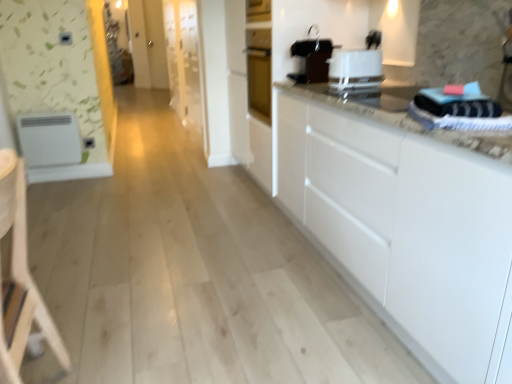
Question: Is light wood armchair at left surrounding white matte refrigerator at left, placed as the second appliance when sorted from right to left?

Choices:
 (A) yes
 (B) no

Answer: (B)

Question: Does light wood armchair at left have a greater height compared to white matte refrigerator at left, placed as the second appliance when sorted from right to left?

Choices:
 (A) yes
 (B) no

Answer: (A)

Question: From the image's perspective, is light wood armchair at left under white matte refrigerator at left, the 2th appliance when ordered from top to bottom?

Choices:
 (A) no
 (B) yes

Answer: (B)

Question: Does light wood armchair at left have a greater width compared to white matte refrigerator at left, the 2th appliance when ordered from top to bottom?

Choices:
 (A) yes
 (B) no

Answer: (A)

Question: Does light wood armchair at left come behind white matte refrigerator at left, which is counted as the 1th appliance, starting from the left?

Choices:
 (A) no
 (B) yes

Answer: (A)

Question: From a real-world perspective, is light wood armchair at left located beneath white matte refrigerator at left, placed as the second appliance when sorted from right to left?

Choices:
 (A) no
 (B) yes

Answer: (A)

Question: From a real-world perspective, is black plastic coffee maker at upper center, which appears as the 2th appliance when viewed from the back, on top of light wood armchair at left?

Choices:
 (A) no
 (B) yes

Answer: (B)

Question: Is black plastic coffee maker at upper center, placed as the 1th appliance when sorted from right to left, positioned in front of light wood armchair at left?

Choices:
 (A) yes
 (B) no

Answer: (B)

Question: From the image's perspective, is black plastic coffee maker at upper center, which appears as the 2th appliance when viewed from the back, above light wood armchair at left?

Choices:
 (A) yes
 (B) no

Answer: (A)

Question: Does black plastic coffee maker at upper center, which is counted as the first appliance, starting from the top, have a lesser width compared to light wood armchair at left?

Choices:
 (A) yes
 (B) no

Answer: (A)

Question: Could you tell me if black plastic coffee maker at upper center, the 2th appliance positioned from the left, is facing light wood armchair at left?

Choices:
 (A) no
 (B) yes

Answer: (A)

Question: Is black plastic coffee maker at upper center, the 2th appliance positioned from the left, bigger than light wood armchair at left?

Choices:
 (A) no
 (B) yes

Answer: (A)

Question: Does black plastic coffee maker at upper center, placed as the 1th appliance when sorted from right to left, lie behind white glossy toaster at upper center?

Choices:
 (A) no
 (B) yes

Answer: (B)